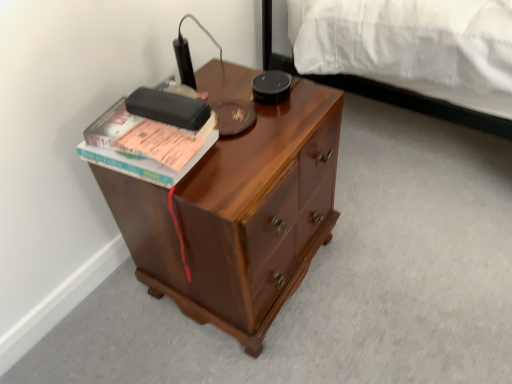
Find the location of `empty space that is ontop of hardcover book at upper left (from a real-world perspective)`. empty space that is ontop of hardcover book at upper left (from a real-world perspective) is located at coordinates (165, 102).